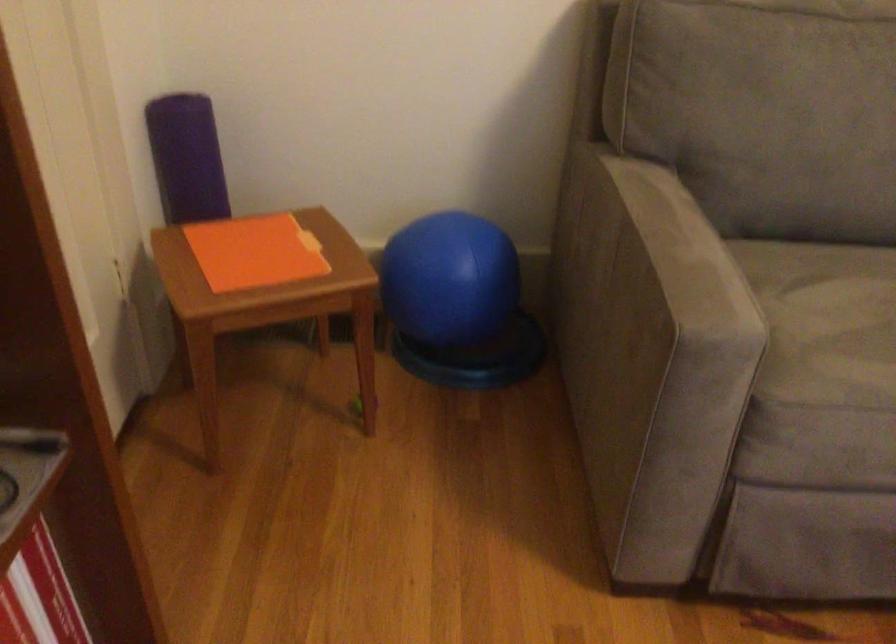
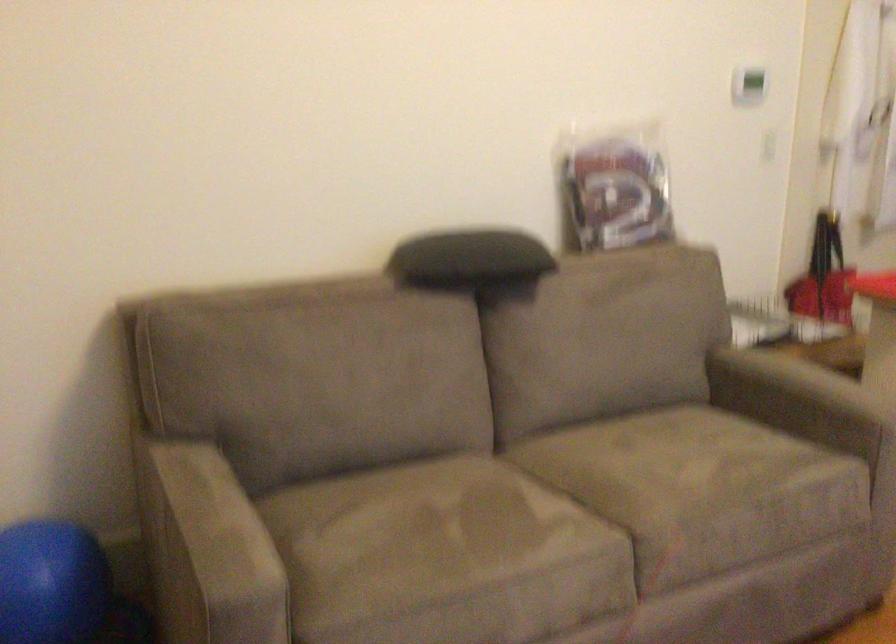
Question: The camera is either moving clockwise (left) or counter-clockwise (right) around the object. The first image is from the beginning of the video and the second image is from the end. Is the camera moving left or right when shooting the video?

Choices:
 (A) Left
 (B) Right

Answer: (A)